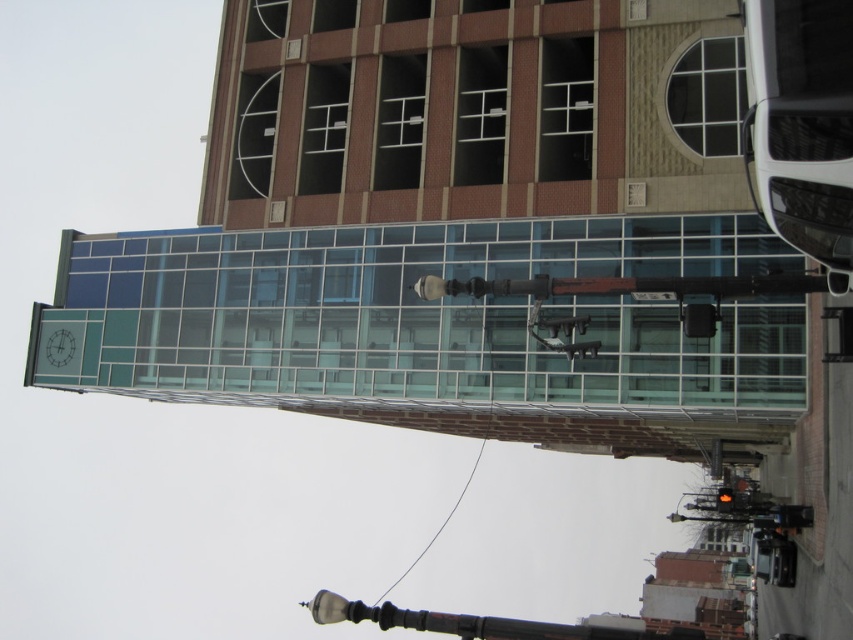
Question: Which object is closer to the camera taking this photo?

Choices:
 (A) orange glass traffic light at center
 (B) clear wire at center

Answer: (A)

Question: Which point is farther to the camera?

Choices:
 (A) (728, 499)
 (B) (451, 508)

Answer: (B)

Question: Which point is farther to the camera?

Choices:
 (A) orange glass traffic light at center
 (B) clear wire at center

Answer: (B)

Question: Is clear wire at center wider than orange glass traffic light at center?

Choices:
 (A) no
 (B) yes

Answer: (B)

Question: Does clear wire at center appear over orange glass traffic light at center?

Choices:
 (A) yes
 (B) no

Answer: (B)

Question: Is clear wire at center below orange glass traffic light at center?

Choices:
 (A) no
 (B) yes

Answer: (B)